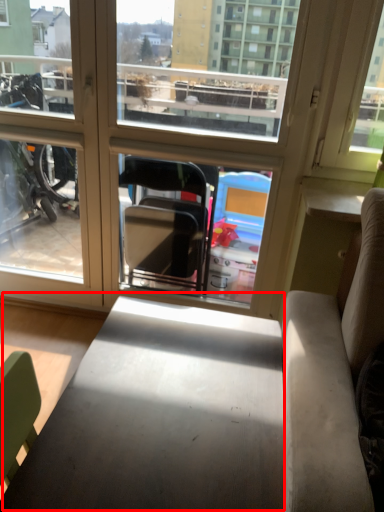
Question: From the image's perspective, what is the correct spatial positioning of table (annotated by the red box) in reference to window?

Choices:
 (A) below
 (B) above

Answer: (A)